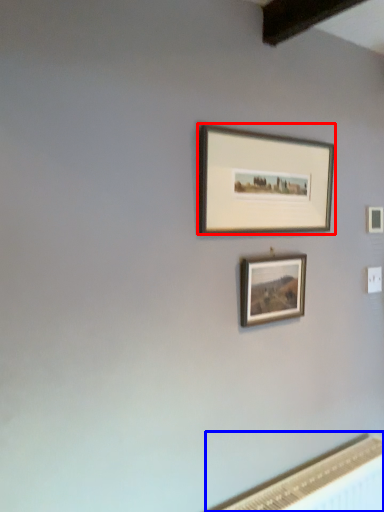
Question: Which object is closer to the camera taking this photo, picture frame (highlighted by a red box) or radiator (highlighted by a blue box)?

Choices:
 (A) picture frame
 (B) radiator

Answer: (B)